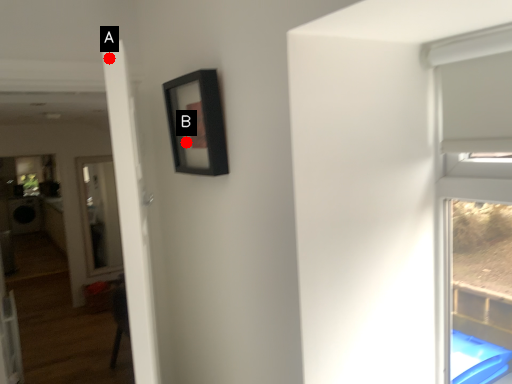
Question: Two points are circled on the image, labeled by A and B beside each circle. Among these points, which one is nearest to the camera?

Choices:
 (A) A is closer
 (B) B is closer

Answer: (A)